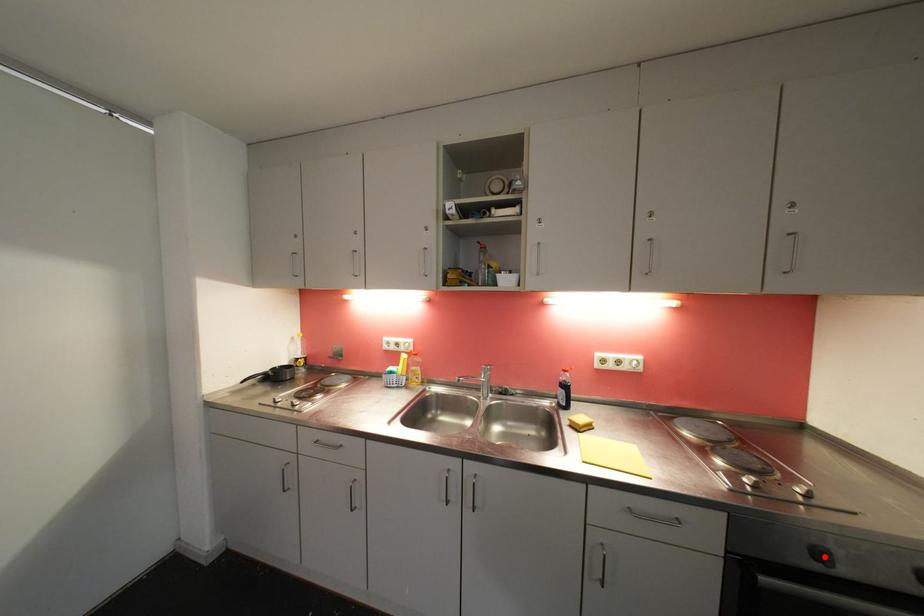
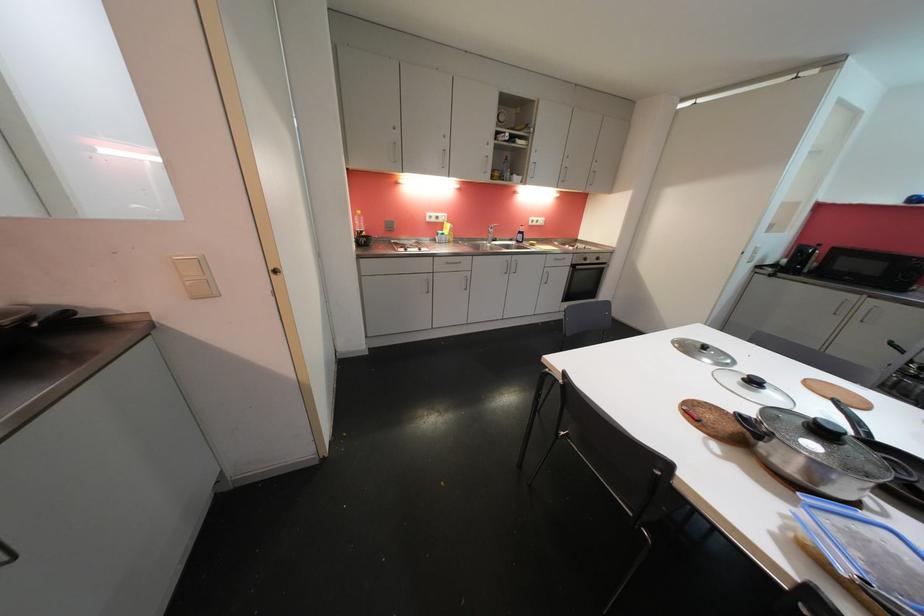
Question: A red point is marked in image1. In image2, is the corresponding 3D point closer to the camera or farther? Reply with the corresponding letter.

Choices:
 (A) The corresponding 3D point is closer.
 (B) The corresponding 3D point is farther.

Answer: (B)